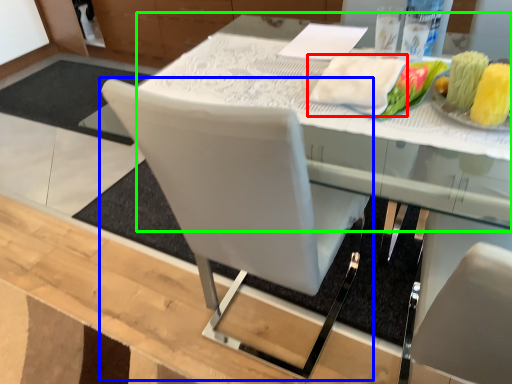
Question: Which object is the farthest from cloth (highlighted by a red box)? Choose among these: chair (highlighted by a blue box) or round table (highlighted by a green box).

Choices:
 (A) chair
 (B) round table

Answer: (A)